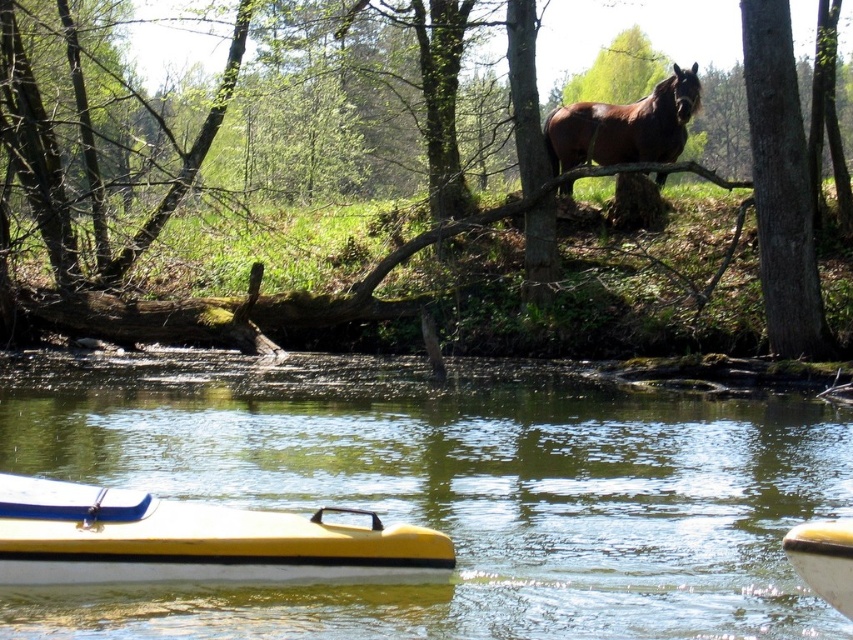
From the picture: You are an artist preparing to sketch this scene. You need to decide which object, the brown wood tree at upper center or the brown glossy horse at upper center, should be drawn first based on their size. Which one should you start with?

The brown wood tree at upper center is larger in size than the brown glossy horse at upper center, so you should start by drawing the brown wood tree at upper center first.

You are planning to carry the yellow matte kayak at lower left across the brown rough bark tree at upper right. Considering their widths, which object is wider and needs more space to maneuver?

The yellow matte kayak at lower left is wider than the brown rough bark tree at upper right, so it requires more space to maneuver.